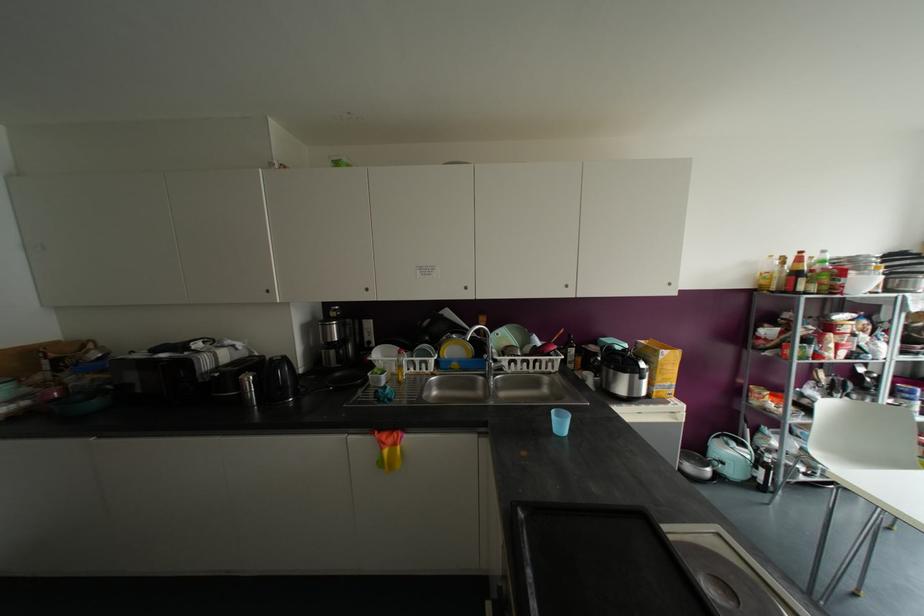
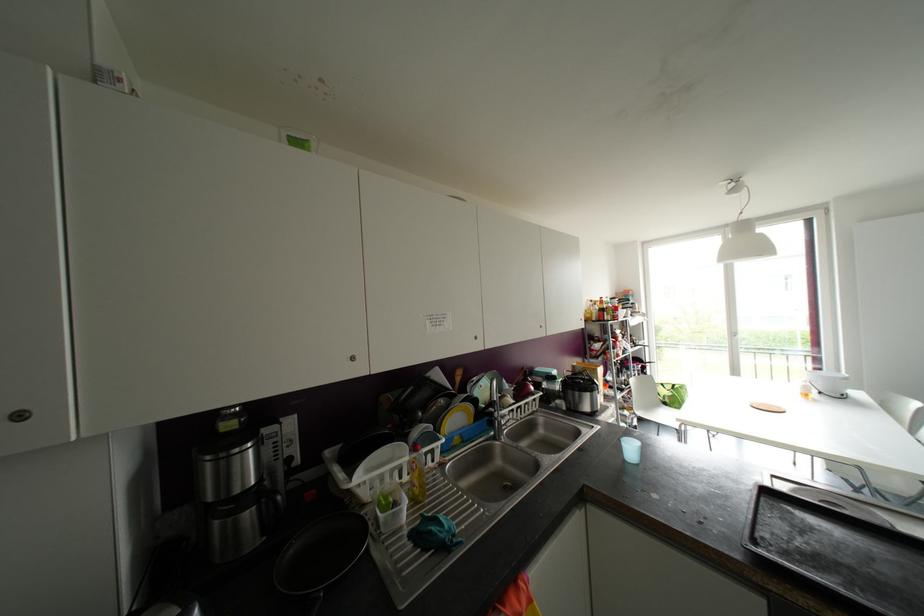
Question: I am providing you with two images of the same scene from different viewpoints. Please identify which objects are invisible in image2.

Choices:
 (A) chair sitting surface
 (B) cabinet door handle
 (C) yellow soap bottle
 (D) none of these

Answer: (D)